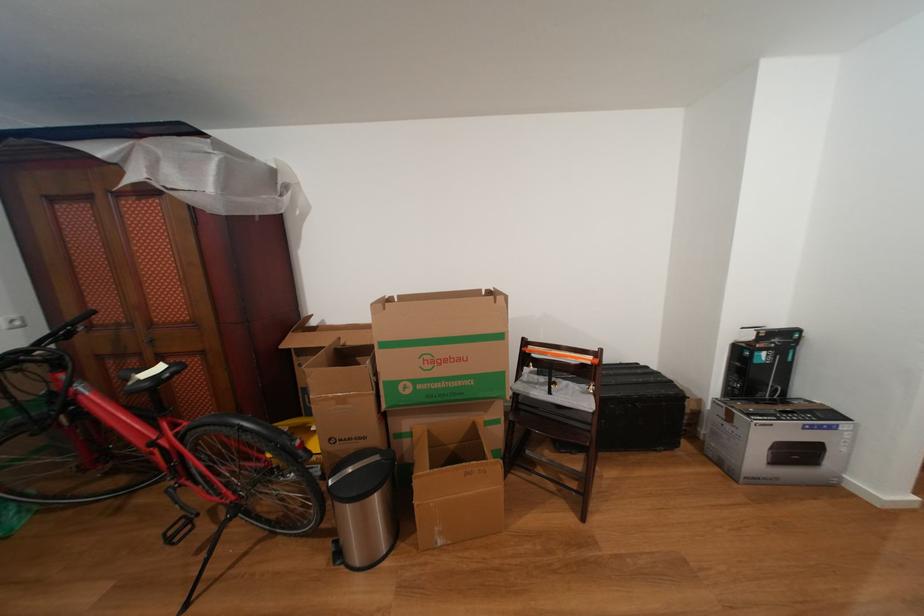
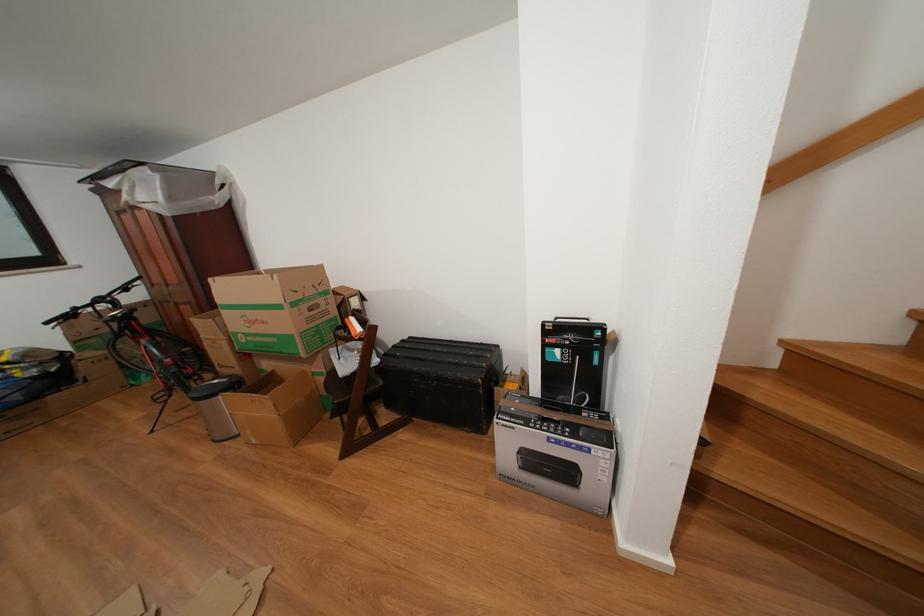
Question: The images are taken continuously from a first-person perspective. In which direction are you moving?

Choices:
 (A) Left
 (B) Right
 (C) Forward
 (D) Backward

Answer: (B)